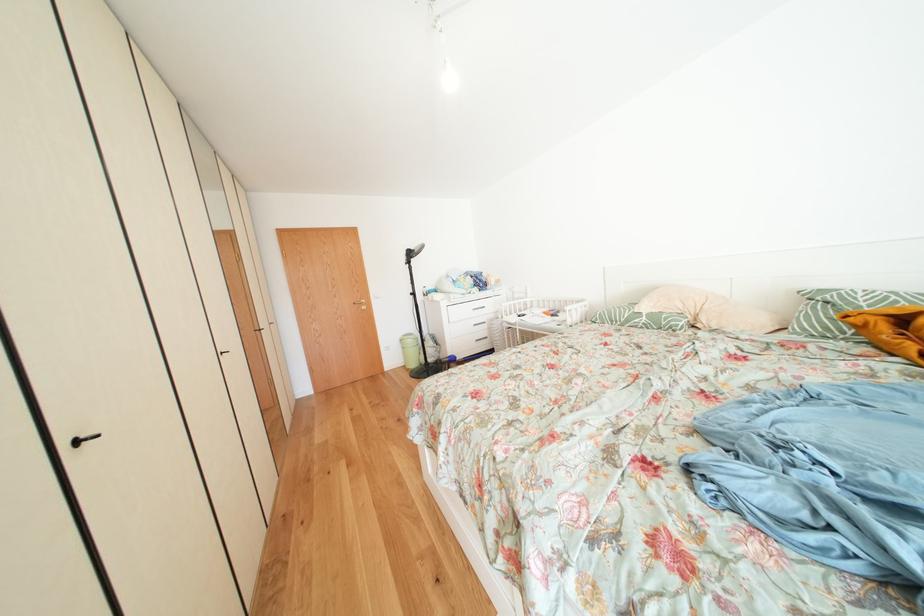
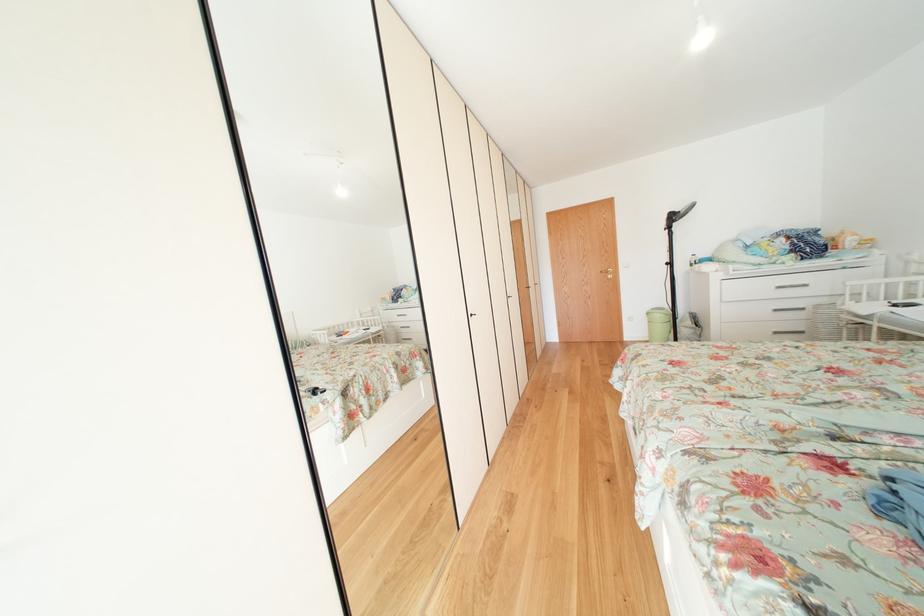
The point at (409, 341) is marked in the first image. Where is the corresponding point in the second image?

(657, 314)